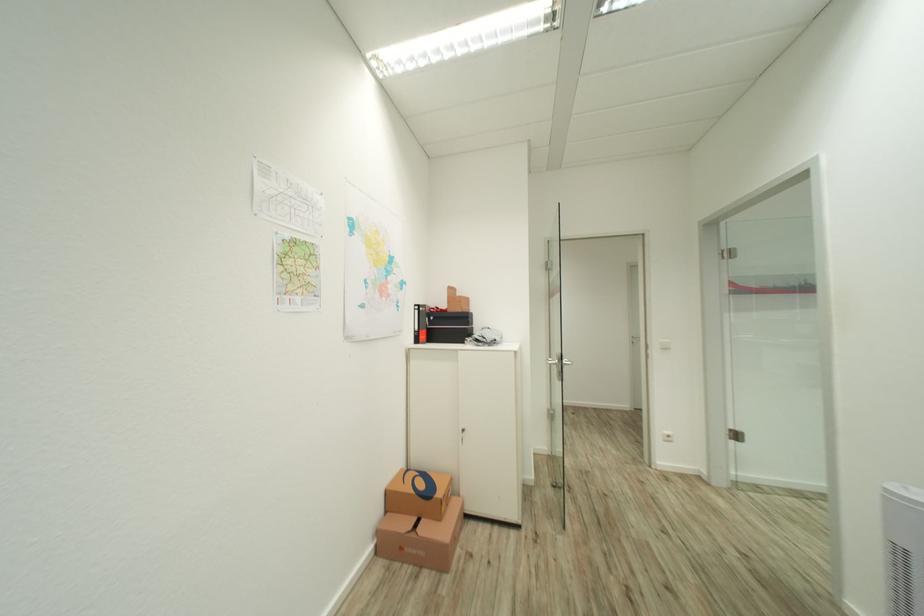
Image resolution: width=924 pixels, height=616 pixels. What do you see at coordinates (664, 344) in the screenshot?
I see `the white light switch` at bounding box center [664, 344].